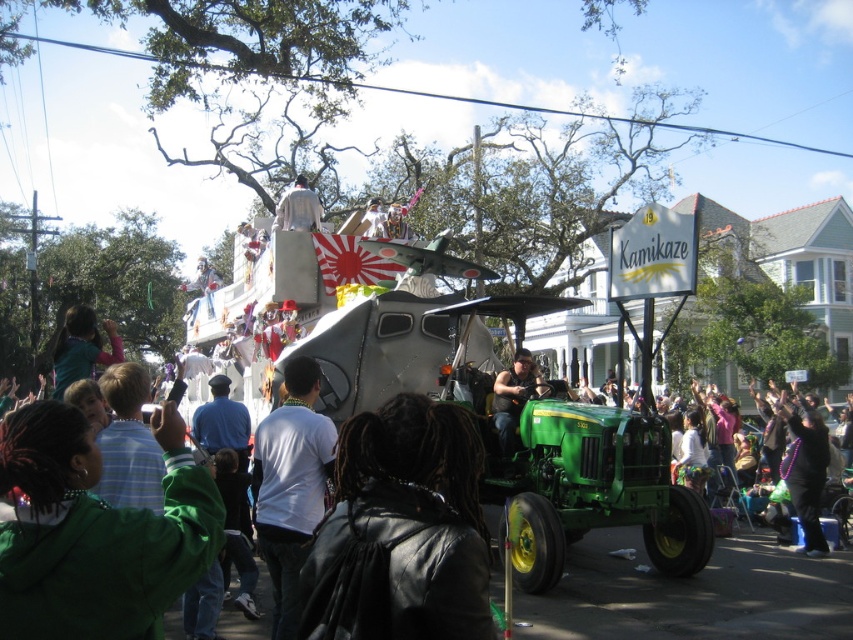
You are a photographer at the parade, and you want to capture both the black leather jacket at center and the white shirt at center in a single photo. Which one should you position to the left side of your frame to include both?

The white shirt at center should be positioned to the left side of your frame because the black leather jacket at center is to the right of the white shirt at center.

You are a photographer at the parade and want to capture both the black leather jacket at center and the white shirt at center in a single photo. Which clothing item should you focus on first to ensure both are in frame?

The black leather jacket at center has a lesser height compared to white shirt at center, so you should focus on the white shirt at center first to ensure both are in frame.

In the scene shown: You are a photographer at the parade. You want to take a photo of the white fabric at upper center without the black leather jacket at lower right appearing in the foreground. Is this possible?

The black leather jacket at lower right is positioned under the white fabric at upper center, so it is in the foreground. Therefore, it would be difficult to capture the white fabric at upper center without the black leather jacket at lower right appearing in the foreground.